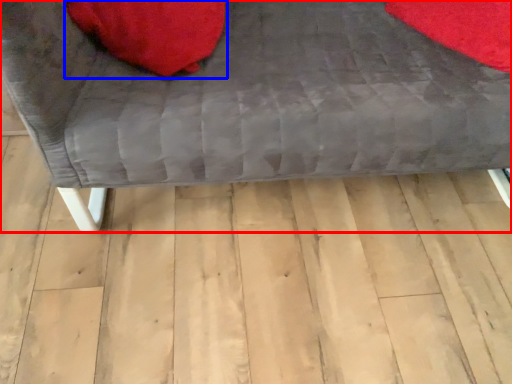
Question: Which point is further to the camera, furniture (highlighted by a red box) or bean bag chair (highlighted by a blue box)?

Choices:
 (A) furniture
 (B) bean bag chair

Answer: (B)